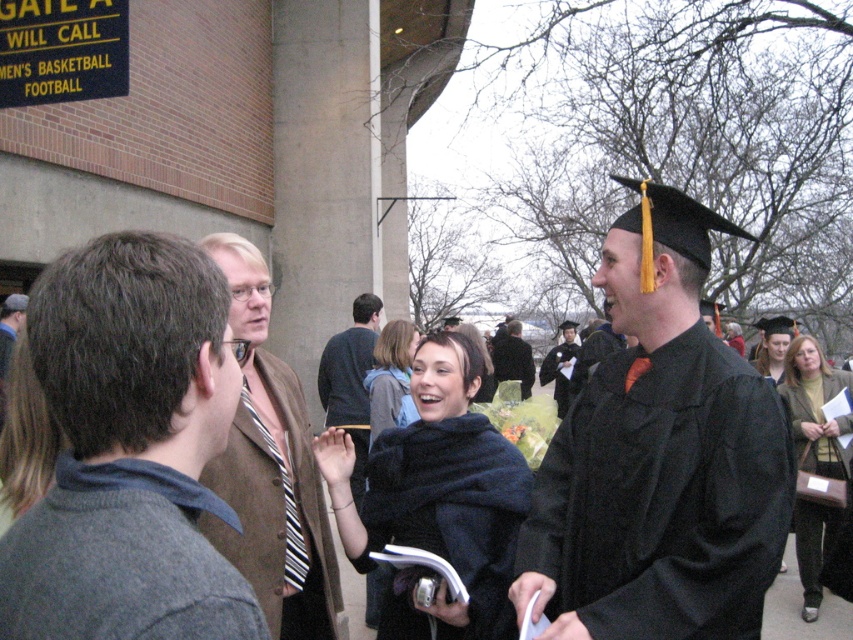
You are standing at the point with coordinates point (659, 456). What is the color of the graduation gown you are standing on?

The point (659, 456) is on a matte black graduation gown at right, so the graduation gown you are standing on is matte black.

You are a photographer trying to capture a group photo of the dark gray woolen robe at center and the matte black graduation cap at upper right. If your camera has a maximum focus range of 20 feet, will you be able to capture both subjects clearly in the same frame?

The dark gray woolen robe at center is 21.60 feet from the matte black graduation cap at upper right. Since the distance exceeds the camera maximum focus range of 20 feet, both subjects cannot be captured clearly in the same frame.